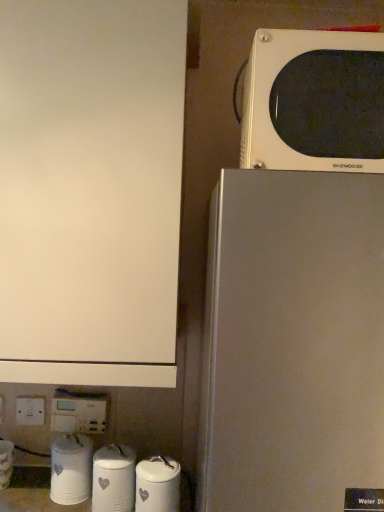
Question: Considering the positions of white glossy canister at lower center, which is the second appliance from right to left, and white matte cabinet at upper left in the image, is white glossy canister at lower center, which is the second appliance from right to left, wider or thinner than white matte cabinet at upper left?

Choices:
 (A) wide
 (B) thin

Answer: (B)

Question: Considering the positions of white glossy canister at lower center, which is the second appliance from right to left, and white matte cabinet at upper left in the image, is white glossy canister at lower center, which is the second appliance from right to left, taller or shorter than white matte cabinet at upper left?

Choices:
 (A) tall
 (B) short

Answer: (B)

Question: Based on their relative distances, which object is farther from the white glossy water filter at lower left, positioned as the 4th appliance in right-to-left order?

Choices:
 (A) white matte microwave at upper right
 (B) white plastic electric outlet at lower left
 (C) white glossy canister at lower center, the third appliance in the left-to-right sequence
 (D) white glossy canisters at lower left, the second appliance from the left
 (E) satin silver refrigerator at right

Answer: (A)

Question: Which of these objects is positioned farthest from the satin silver refrigerator at right?

Choices:
 (A) white plastic electric outlet at lower left
 (B) white glossy canisters at lower left, the second appliance from the left
 (C) white glossy water filter at lower left, the first appliance positioned from the left
 (D) white glossy canister at lower center, which is the 4th appliance in left-to-right order
 (E) white matte cabinet at upper left

Answer: (C)